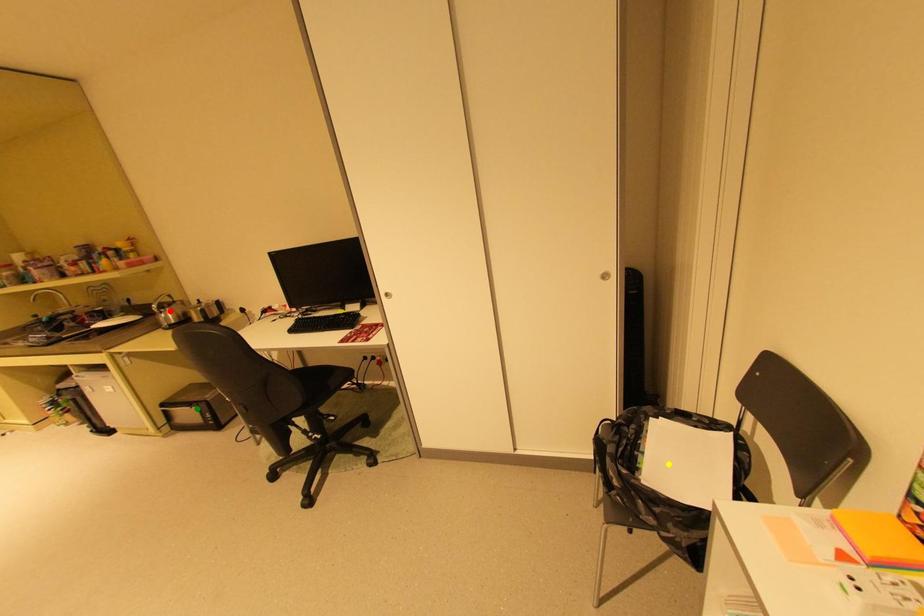
Order these from nearest to farthest:
- yellow point
- red point
- green point

yellow point < green point < red point